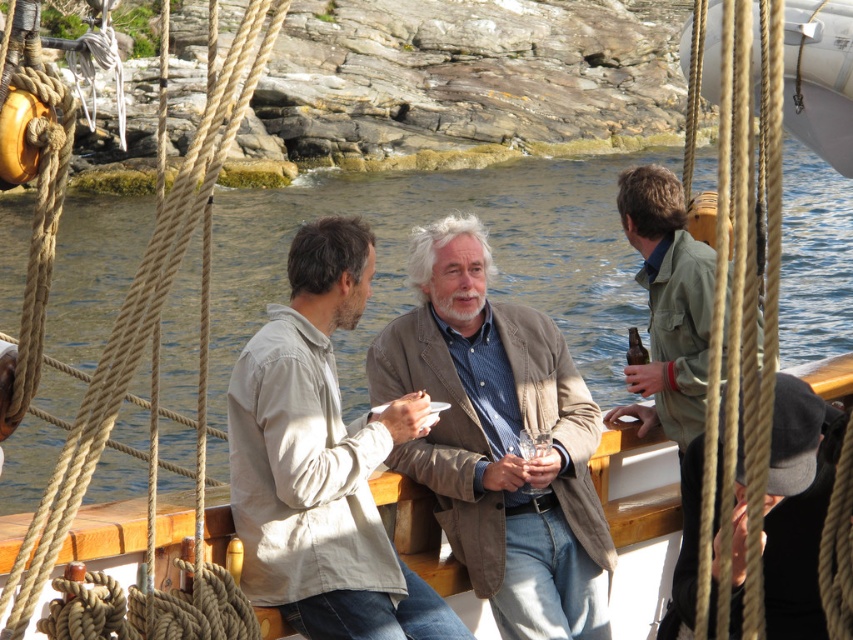
Who is more forward, (463,422) or (799,420)?

Point (799,420) is in front.

Looking at this image, who is positioned more to the right, matte brown blazer at center or black wool cap at lower right?

black wool cap at lower right

Identify the location of matte brown blazer at center. The width and height of the screenshot is (853, 640). (498, 440).

Does matte brown blazer at center lie behind green canvas jacket at right?

Yes.

In the scene shown: Which is more to the right, matte brown blazer at center or green canvas jacket at right?

Positioned to the right is green canvas jacket at right.

Between point (468, 378) and point (672, 278), which one is positioned in front?

Point (468, 378) is more forward.

Where is `matte brown blazer at center`? Image resolution: width=853 pixels, height=640 pixels. matte brown blazer at center is located at coordinates (498, 440).

Does light brown cotton shirt at center come behind black wool cap at lower right?

Yes.

Between light brown cotton shirt at center and black wool cap at lower right, which one has less height?

With less height is light brown cotton shirt at center.

Who is more distant from viewer, (231, 376) or (793, 499)?

Positioned behind is point (231, 376).

At what (x,y) coordinates should I click in order to perform the action: click on light brown cotton shirt at center. Please return your answer as a coordinate pair (x, y). Looking at the image, I should click on (321, 460).